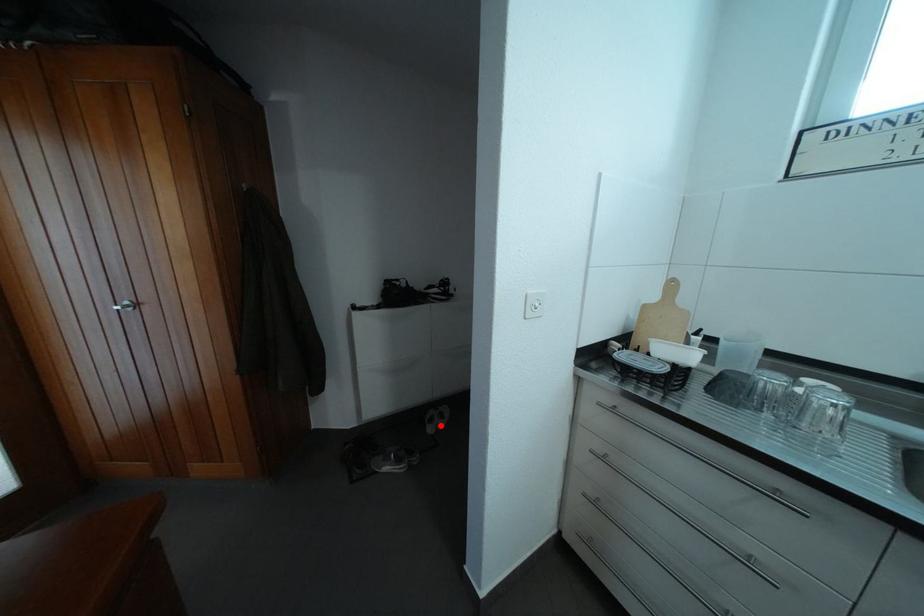
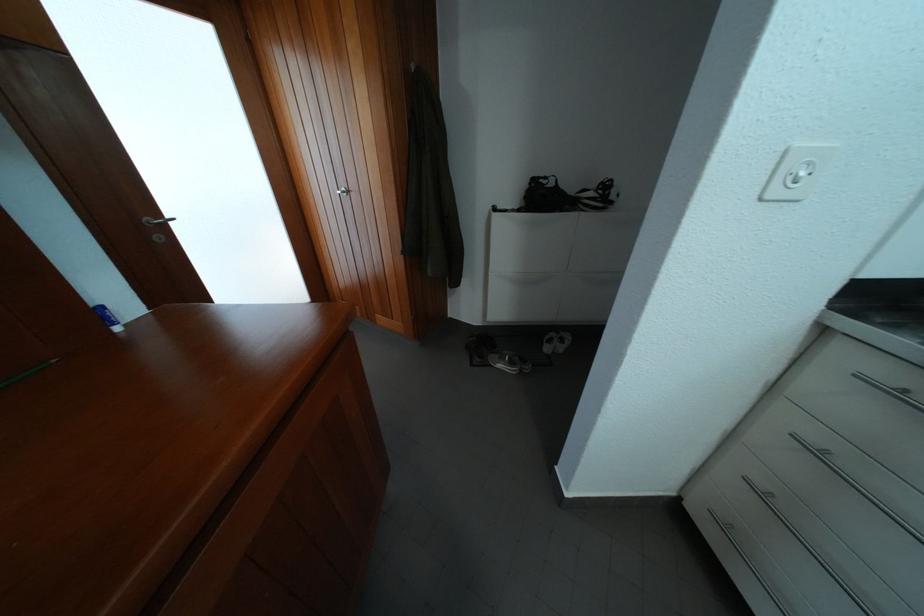
In the second image, find the point that corresponds to the highlighted location in the first image.

(560, 346)